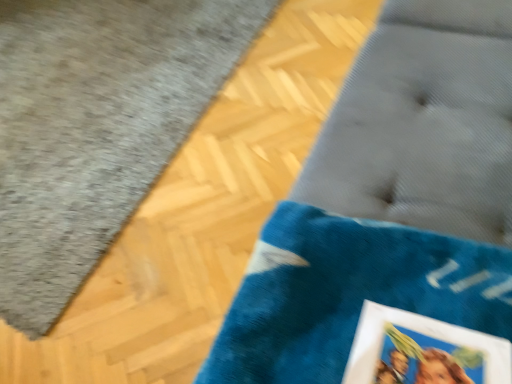
The image size is (512, 384). What do you see at coordinates (389, 201) in the screenshot?
I see `velvet blue cushion at lower right` at bounding box center [389, 201].

What is the approximate height of velvet blue cushion at lower right?

It is 74.90 centimeters.

At what (x,y) coordinates should I click in order to perform the action: click on velvet blue cushion at lower right. Please return your answer as a coordinate pair (x, y). Looking at the image, I should click on (389, 201).

In order to click on blue velvety bath mat at lower right in this screenshot , I will do `click(96, 126)`.

What do you see at coordinates (96, 126) in the screenshot?
I see `blue velvety bath mat at lower right` at bounding box center [96, 126].

Measure the distance between point (x=104, y=34) and camera.

A distance of 2.10 meters exists between point (x=104, y=34) and camera.

What is the approximate width of blue velvety bath mat at lower right?

1.63 meters.

At what (x,y) coordinates should I click in order to perform the action: click on velvet blue cushion at lower right. Please return your answer as a coordinate pair (x, y). The image size is (512, 384). Looking at the image, I should click on (389, 201).

From the picture: Is velvet blue cushion at lower right to the right of blue velvety bath mat at lower right from the viewer's perspective?

Yes, velvet blue cushion at lower right is to the right of blue velvety bath mat at lower right.

Is velvet blue cushion at lower right positioned before blue velvety bath mat at lower right?

Yes, the depth of velvet blue cushion at lower right is less than that of blue velvety bath mat at lower right.

Does point (476, 312) appear closer or farther from the camera than point (44, 65)?

Point (476, 312) is closer to the camera than point (44, 65).

From the image's perspective, is velvet blue cushion at lower right below blue velvety bath mat at lower right?

Indeed, from the image's perspective, velvet blue cushion at lower right is shown beneath blue velvety bath mat at lower right.

From a real-world perspective, between velvet blue cushion at lower right and blue velvety bath mat at lower right, who is vertically higher?

velvet blue cushion at lower right, from a real-world perspective.

Which object is wider, velvet blue cushion at lower right or blue velvety bath mat at lower right?

Result: blue velvety bath mat at lower right.

Who is taller, velvet blue cushion at lower right or blue velvety bath mat at lower right?

velvet blue cushion at lower right.

Is velvet blue cushion at lower right smaller than blue velvety bath mat at lower right?

No, velvet blue cushion at lower right is not smaller than blue velvety bath mat at lower right.

Is velvet blue cushion at lower right situated inside blue velvety bath mat at lower right or outside?

velvet blue cushion at lower right lies outside blue velvety bath mat at lower right.

Is velvet blue cushion at lower right not near blue velvety bath mat at lower right?

Yes, velvet blue cushion at lower right and blue velvety bath mat at lower right are located far from each other.

Is velvet blue cushion at lower right facing towards blue velvety bath mat at lower right?

Yes.

At what (x,y) coordinates should I click in order to perform the action: click on furniture on the right of blue velvety bath mat at lower right. Please return your answer as a coordinate pair (x, y). The width and height of the screenshot is (512, 384). Looking at the image, I should click on (389, 201).

Is blue velvety bath mat at lower right to the left or to the right of velvet blue cushion at lower right in the image?

Based on their positions, blue velvety bath mat at lower right is located to the left of velvet blue cushion at lower right.

Which is behind, blue velvety bath mat at lower right or velvet blue cushion at lower right?

blue velvety bath mat at lower right is more distant.

Which is more distant, (123, 59) or (289, 316)?

Positioned behind is point (123, 59).

From the image's perspective, is blue velvety bath mat at lower right located above or below velvet blue cushion at lower right?

blue velvety bath mat at lower right is situated higher than velvet blue cushion at lower right in the image.

From a real-world perspective, is blue velvety bath mat at lower right physically below velvet blue cushion at lower right?

Yes, from a real-world perspective, blue velvety bath mat at lower right is below velvet blue cushion at lower right.

Between blue velvety bath mat at lower right and velvet blue cushion at lower right, which one has smaller width?

velvet blue cushion at lower right is thinner.

Can you confirm if blue velvety bath mat at lower right is taller than velvet blue cushion at lower right?

In fact, blue velvety bath mat at lower right may be shorter than velvet blue cushion at lower right.

Is blue velvety bath mat at lower right bigger than velvet blue cushion at lower right?

No, blue velvety bath mat at lower right is not bigger than velvet blue cushion at lower right.

Is velvet blue cushion at lower right inside blue velvety bath mat at lower right?

Definitely not — velvet blue cushion at lower right is not inside blue velvety bath mat at lower right.

Can you see blue velvety bath mat at lower right touching velvet blue cushion at lower right?

blue velvety bath mat at lower right is not next to velvet blue cushion at lower right, and they're not touching.

Consider the image. Is blue velvety bath mat at lower right facing away from velvet blue cushion at lower right?

blue velvety bath mat at lower right does not have its back to velvet blue cushion at lower right.

What's the angular difference between blue velvety bath mat at lower right and velvet blue cushion at lower right's facing directions?

178 degrees.

You are a GUI agent. You are given a task and a screenshot of the screen. Output one action in this format:
    pyautogui.click(x=<x>, y=<y>)
    Task: Click on the furniture below the blue velvety bath mat at lower right (from the image's perspective)
    
    Given the screenshot: What is the action you would take?
    pyautogui.click(x=389, y=201)

Identify the location of furniture that appears in front of the blue velvety bath mat at lower right. (389, 201).

Where is `furniture below the blue velvety bath mat at lower right (from the image's perspective)`? The image size is (512, 384). furniture below the blue velvety bath mat at lower right (from the image's perspective) is located at coordinates pyautogui.click(x=389, y=201).